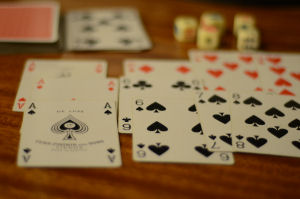
At what (x,y) coordinates should I click in order to perform the action: click on wooden table. Please return your answer as a coordinate pair (x, y). Looking at the image, I should click on (156, 181).